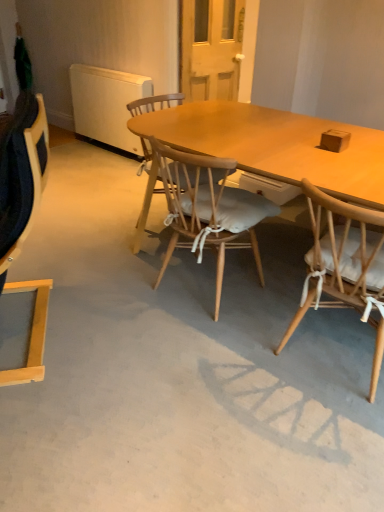
This screenshot has width=384, height=512. I want to click on free space underneath wooden chair with white cushion at right, the 3th chair from the left (from a real-world perspective), so click(x=334, y=351).